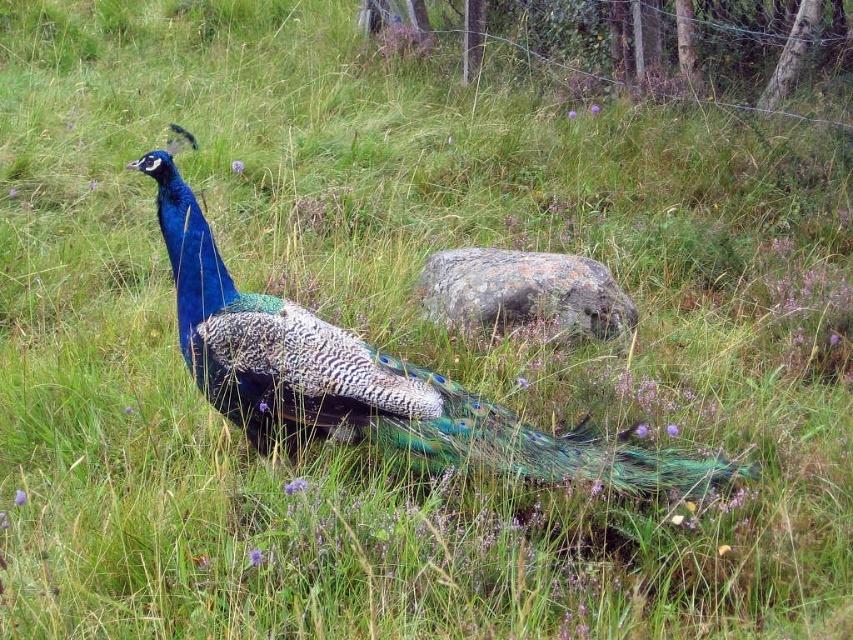
Question: Which point is farther to the camera?

Choices:
 (A) (595, 324)
 (B) (405, 394)

Answer: (A)

Question: Does shiny blue peacock at center appear over gray rough rock at center?

Choices:
 (A) yes
 (B) no

Answer: (B)

Question: Does shiny blue peacock at center appear over gray rough rock at center?

Choices:
 (A) yes
 (B) no

Answer: (B)

Question: Is shiny blue peacock at center above gray rough rock at center?

Choices:
 (A) no
 (B) yes

Answer: (A)

Question: Among these objects, which one is nearest to the camera?

Choices:
 (A) gray rough rock at center
 (B) shiny blue peacock at center

Answer: (B)